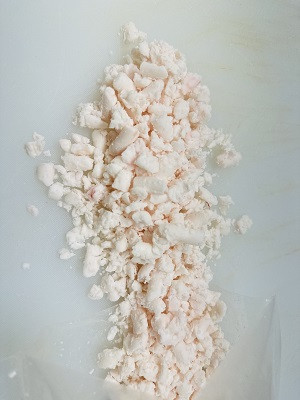
Find the location of a particular element. white surface is located at coordinates (278, 287).